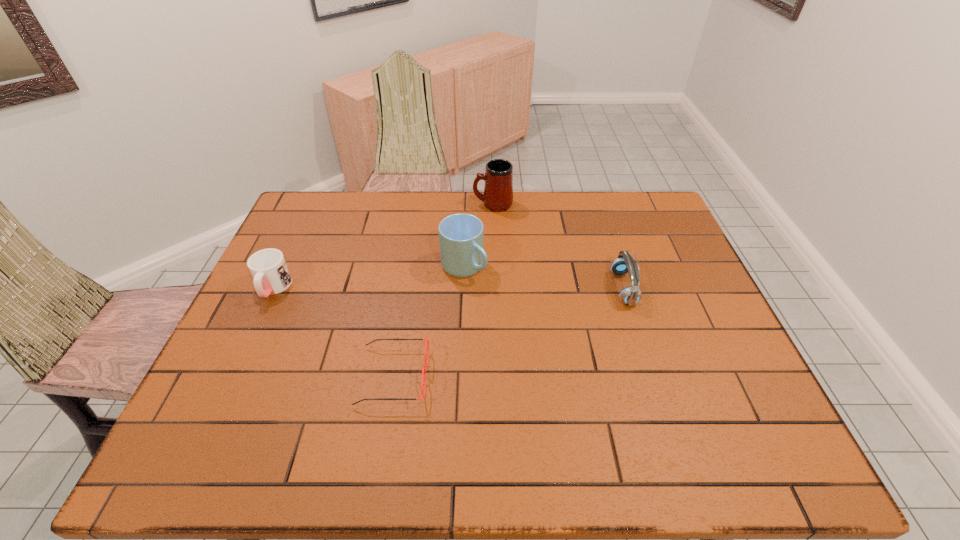
I want to click on the farthest mug, so click(x=498, y=190).

Identify the location of the third tallest object. The image size is (960, 540). (624, 263).

Where is `headset`? The image size is (960, 540). headset is located at coordinates (624, 263).

This screenshot has height=540, width=960. I want to click on the leftmost object, so click(x=271, y=275).

Locate an element on the screen. the shortest mug is located at coordinates (271, 275).

Image resolution: width=960 pixels, height=540 pixels. In order to click on spectacles in this screenshot , I will do `click(427, 340)`.

Locate an element on the screen. This screenshot has height=540, width=960. the nearest object is located at coordinates (427, 340).

Locate an element on the screen. The height and width of the screenshot is (540, 960). vacant space positioned 0.290m on the side of the farthest object with the handle is located at coordinates (390, 204).

This screenshot has height=540, width=960. Identify the location of free location located on the side of the farthest object with the handle. (375, 204).

I want to click on vacant space located on the side of the farthest object with the handle, so click(442, 204).